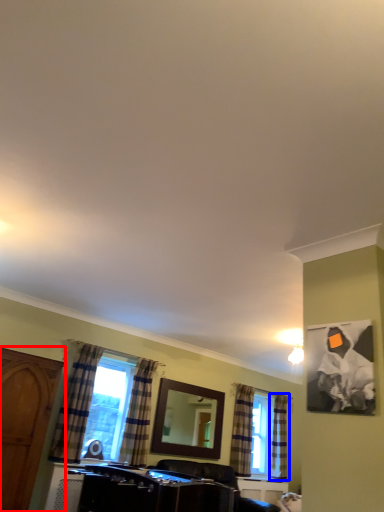
Question: Which of the following is the closest to the observer, cabinetry (highlighted by a red box) or curtain (highlighted by a blue box)?

Choices:
 (A) cabinetry
 (B) curtain

Answer: (A)